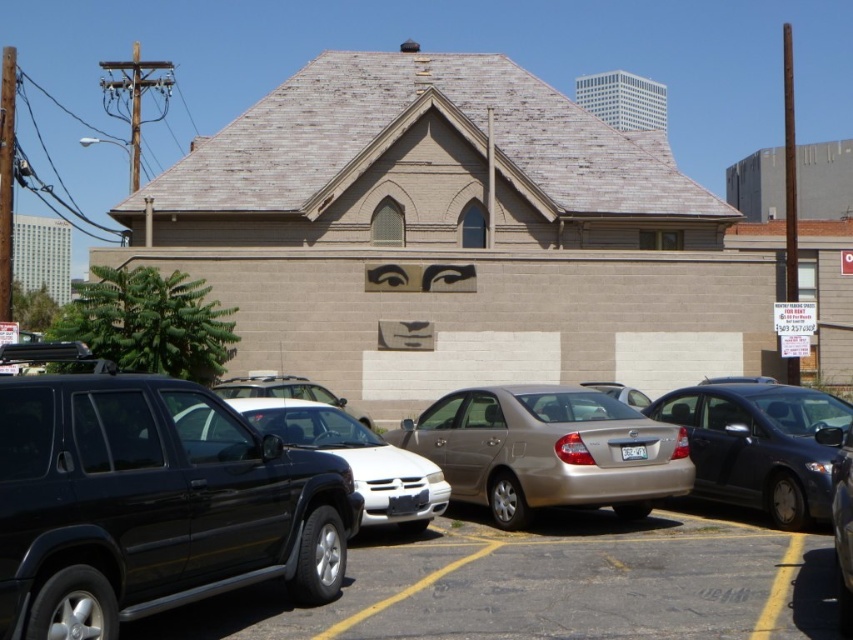
You are a delivery person who needs to park your 6.5 feet tall delivery van. You see the black matte suv at left and the satin black sedan at center in the parking lot. Which vehicle should you park next to if you need to ensure there is enough vertical space for your van?

The black matte suv at left is much taller than the satin black sedan at center, so you should park next to the satin black sedan at center to ensure there is enough vertical space for your 6.5 feet tall delivery van.

You are a delivery driver approaching the building and need to park your vehicle. There are two cars in the parking lot, a matte black suv at center and a satin black sedan at center. Which car is blocking your path closer to you?

The matte black suv at center is closer to the viewer than the satin black sedan at center, so the matte black suv at center is blocking your path closer to you.

You are standing at the entrance of the building and want to locate the matte black suv at center. According to the coordinates provided, where would you find it in relation to the entrance?

The matte black suv at center is located at coordinates (538, 586), which places it to the right and slightly forward from the entrance.